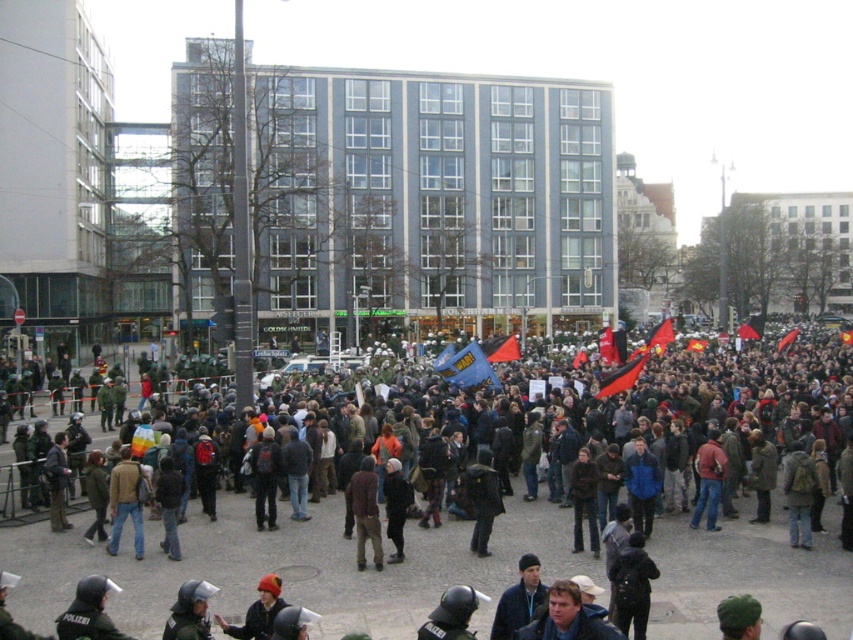
Question: Which of the following is the farthest from the observer?

Choices:
 (A) (358, 536)
 (B) (485, 536)
 (C) (523, 612)
 (D) (270, 618)

Answer: (B)

Question: Is brown leather jacket at lower left to the left of dark blue jacket at center from the viewer's perspective?

Choices:
 (A) no
 (B) yes

Answer: (B)

Question: Which point appears farthest from the camera in this image?

Choices:
 (A) (506, 588)
 (B) (132, 513)

Answer: (B)

Question: From the image, what is the correct spatial relationship of blue fabric jacket at lower center in relation to metallic helmet at lower left?

Choices:
 (A) above
 (B) below

Answer: (A)

Question: Which object appears farthest from the camera in this image?

Choices:
 (A) red knit hat at lower center
 (B) brown fabric jacket at center
 (C) dark brown leather jacket at center

Answer: (B)

Question: Observing the image, what is the correct spatial positioning of blue fabric jacket at lower center in reference to dark blue jacket at center?

Choices:
 (A) below
 (B) above

Answer: (B)